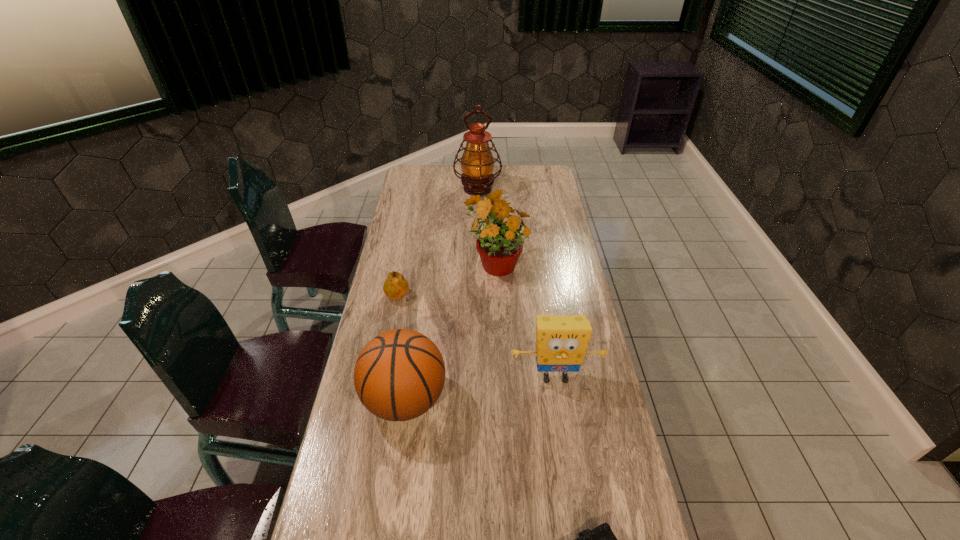
You are a GUI agent. You are given a task and a screenshot of the screen. Output one action in this format:
    pyautogui.click(x=<x>, y=<y>)
    Task: Click on the free space located 0.220m on the front of the basketball
    
    Given the screenshot: What is the action you would take?
    pyautogui.click(x=386, y=530)

Where is `free spot located 0.240m on the face of the sponge`? free spot located 0.240m on the face of the sponge is located at coordinates (570, 478).

You are a GUI agent. You are given a task and a screenshot of the screen. Output one action in this format:
    pyautogui.click(x=<x>, y=<y>)
    Task: Click on the vacant space located on the back of the fourth nearest object
    This screenshot has width=960, height=540.
    Given the screenshot: What is the action you would take?
    pyautogui.click(x=406, y=256)

The width and height of the screenshot is (960, 540). I want to click on object that is at the far edge, so click(x=477, y=163).

Image resolution: width=960 pixels, height=540 pixels. I want to click on basketball that is at the left edge, so tap(399, 375).

Find the location of a particular element. The width and height of the screenshot is (960, 540). pear that is at the left edge is located at coordinates (396, 286).

This screenshot has width=960, height=540. Find the location of `object that is positioned at the right edge`. object that is positioned at the right edge is located at coordinates (561, 341).

In the image, there is a desktop. Identify the location of vacant space at the left edge. (406, 194).

Locate an element on the screen. free space at the right edge of the desktop is located at coordinates (543, 251).

Identify the location of free space at the far right corner of the desktop. The image size is (960, 540). [x=543, y=165].